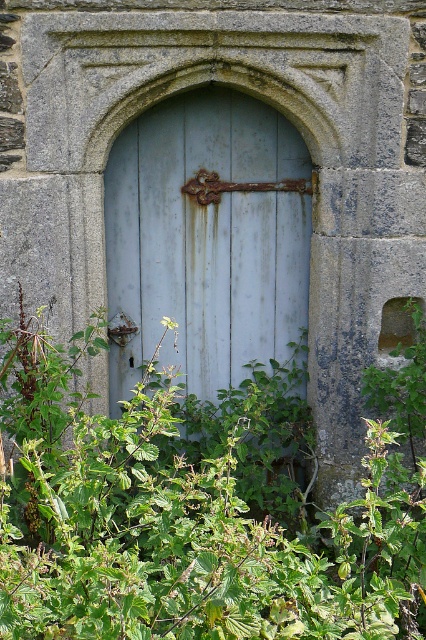
Does green leafy plant at center have a greater width compared to rusty metal door at center?

Indeed, green leafy plant at center has a greater width compared to rusty metal door at center.

Between green leafy plant at center and rusty metal door at center, which one is positioned lower?

Positioned lower is green leafy plant at center.

Which is in front, point (183, 456) or point (279, 252)?

Point (183, 456) is more forward.

Image resolution: width=426 pixels, height=640 pixels. I want to click on green leafy plant at center, so click(x=192, y=509).